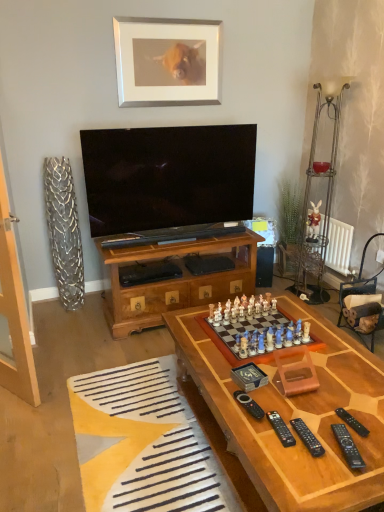
This screenshot has width=384, height=512. What do you see at coordinates (358, 285) in the screenshot? I see `wooden armchair at right` at bounding box center [358, 285].

What is the approximate width of white radiator at right?

It is 6.74 centimeters.

Looking at this image, in order to face yellow fabric rug at lower left, should I rotate leftwards or rightwards?

To align with it, rotate left about 6.375°.

You are a GUI agent. You are given a task and a screenshot of the screen. Output one action in this format:
    pyautogui.click(x=<x>, y=<y>)
    Task: Click on the wooden armchair at right
    Image resolution: width=384 pixels, height=512 pixels.
    Given the screenshot: What is the action you would take?
    pyautogui.click(x=358, y=285)

Does black plastic remote at center, which ranks as the 5th remote in right-to-left order, have a smaller size compared to wooden armchair at right?

Correct, black plastic remote at center, which ranks as the 5th remote in right-to-left order, occupies less space than wooden armchair at right.

Does black plastic remote at center, which appears as the first remote when viewed from the left, have a greater height compared to wooden armchair at right?

No.

Considering the relative positions of black plastic remote at center, which ranks as the 5th remote in right-to-left order, and wooden armchair at right in the image provided, is black plastic remote at center, which ranks as the 5th remote in right-to-left order, in front of wooden armchair at right?

Yes, black plastic remote at center, which ranks as the 5th remote in right-to-left order, is closer to the camera.

How different are the orientations of black plastic remote at center, which appears as the first remote when viewed from the left, and wooden armchair at right in degrees?

black plastic remote at center, which appears as the first remote when viewed from the left, and wooden armchair at right are facing 84.3 degrees away from each other.

You are a GUI agent. You are given a task and a screenshot of the screen. Output one action in this format:
    pyautogui.click(x=<x>, y=<y>)
    Task: Click on the table on the right of the black plastic remote at lower right, which is the 2th remote from left to right
    This screenshot has width=384, height=512.
    Given the screenshot: What is the action you would take?
    pyautogui.click(x=294, y=414)

Considering the positions of point (283, 425) and point (358, 364), is point (283, 425) closer or farther from the camera than point (358, 364)?

Clearly, point (283, 425) is closer to the camera than point (358, 364).

Is black plastic remote at lower right, the 4th remote in the right-to-left sequence, closer to the viewer compared to wooden chessboard at center?

No, the depth of black plastic remote at lower right, the 4th remote in the right-to-left sequence, is greater than that of wooden chessboard at center.

Does black plastic remote at lower right, the 4th remote in the right-to-left sequence, contain wooden chessboard at center?

No, black plastic remote at lower right, the 4th remote in the right-to-left sequence, does not contain wooden chessboard at center.

Is black plastic remote at lower right, marked as the 2th remote in a right-to-left arrangement, spatially inside metallic glass shelf at right, or outside of it?

black plastic remote at lower right, marked as the 2th remote in a right-to-left arrangement, is not enclosed by metallic glass shelf at right.

Could you tell me if black plastic remote at lower right, marked as the 2th remote in a right-to-left arrangement, is turned towards metallic glass shelf at right?

Yes.

Looking at their sizes, would you say black plastic remote at lower right, the fourth remote when ordered from left to right, is wider or thinner than metallic glass shelf at right?

Considering their sizes, black plastic remote at lower right, the fourth remote when ordered from left to right, looks slimmer than metallic glass shelf at right.

Is black plastic remote at lower right, the fourth remote when ordered from left to right, at the right side of metallic glass shelf at right?

Incorrect, black plastic remote at lower right, the fourth remote when ordered from left to right, is not on the right side of metallic glass shelf at right.

From the image's perspective, which is above, white radiator at right or white ceramic rabbit at right?

white ceramic rabbit at right.

Which of these two, white radiator at right or white ceramic rabbit at right, is thinner?

white radiator at right.

Which is more to the left, white radiator at right or white ceramic rabbit at right?

white ceramic rabbit at right.

The image size is (384, 512). Find the location of `toy behind the white radiator at right`. toy behind the white radiator at right is located at coordinates (313, 222).

How distant is white ceramic rabbit at right from silver/metallic picture frame at upper center?

They are 1.55 meters apart.

From the image's perspective, is white ceramic rabbit at right beneath silver/metallic picture frame at upper center?

Yes, from the image's perspective, white ceramic rabbit at right is below silver/metallic picture frame at upper center.

I want to click on picture frame above the white ceramic rabbit at right (from the image's perspective), so click(x=167, y=61).

Is white ceramic rabbit at right at the right side of silver/metallic picture frame at upper center?

Yes, white ceramic rabbit at right is to the right of silver/metallic picture frame at upper center.

Considering the sizes of objects silver/metallic picture frame at upper center and black plastic remote at lower right, which is the 2th remote from left to right, in the image provided, who is shorter, silver/metallic picture frame at upper center or black plastic remote at lower right, which is the 2th remote from left to right,?

black plastic remote at lower right, which is the 2th remote from left to right, is shorter.

Consider the image. Are silver/metallic picture frame at upper center and black plastic remote at lower right, the 4th remote in the right-to-left sequence, beside each other?

No, silver/metallic picture frame at upper center is not with black plastic remote at lower right, the 4th remote in the right-to-left sequence.

Does silver/metallic picture frame at upper center have a smaller size compared to black plastic remote at lower right, which is the 2th remote from left to right?

No, silver/metallic picture frame at upper center is not smaller than black plastic remote at lower right, which is the 2th remote from left to right.

The image size is (384, 512). Find the location of `picture frame above the black plastic remote at lower right, the 4th remote in the right-to-left sequence (from a real-world perspective)`. picture frame above the black plastic remote at lower right, the 4th remote in the right-to-left sequence (from a real-world perspective) is located at coordinates (167, 61).

Considering the sizes of objects wooden chess set at center and black plastic remote at lower right, the third remote in the left-to-right sequence, in the image provided, who is shorter, wooden chess set at center or black plastic remote at lower right, the third remote in the left-to-right sequence,?

With less height is wooden chess set at center.

I want to click on remote that is the 4th object located below the wooden chess set at center (from the image's perspective), so click(307, 437).

From the image's perspective, which one is positioned higher, wooden chess set at center or black plastic remote at lower right, which ranks as the 3th remote in right-to-left order?

wooden chess set at center, from the image's perspective.

Is wooden chess set at center to the right of black plastic remote at lower right, the third remote in the left-to-right sequence, from the viewer's perspective?

In fact, wooden chess set at center is to the left of black plastic remote at lower right, the third remote in the left-to-right sequence.

This screenshot has width=384, height=512. Find the location of `remote that is the 1st object located in front of the wooden armchair at right`. remote that is the 1st object located in front of the wooden armchair at right is located at coordinates (249, 405).

The height and width of the screenshot is (512, 384). In order to click on the 2nd remote counting from the left side of the wooden chessboard at center in this screenshot , I will do `click(281, 429)`.

Looking at the image, which one is located closer to black plastic remote at center, which appears as the first remote when viewed from the left, yellow fabric rug at lower left or wooden chess set at center?

wooden chess set at center.

Looking at the image, which one is located further to metallic glass shelf at right, white radiator at right or black plastic remote at lower right, which appears as the 5th remote when viewed from the left?

The object further to metallic glass shelf at right is black plastic remote at lower right, which appears as the 5th remote when viewed from the left.

Based on their spatial positions, is white radiator at right or wooden chess set at center further from black plastic remote at center, which appears as the first remote when viewed from the left?

white radiator at right is positioned further to the anchor black plastic remote at center, which appears as the first remote when viewed from the left.

When comparing their distances from wooden armchair at right, does black plastic remote at lower right, marked as the 2th remote in a right-to-left arrangement, or wooden chessboard at center seem further?

black plastic remote at lower right, marked as the 2th remote in a right-to-left arrangement, is further to wooden armchair at right.

When comparing their distances from silver/metallic picture frame at upper center, does black plastic remote at lower right, which appears as the 5th remote when viewed from the left, or white radiator at right seem closer?

white radiator at right.

Which object lies further to the anchor point yellow fabric rug at lower left, silver/metallic picture frame at upper center or black plastic remote at lower right, which appears as the 5th remote when viewed from the left?

Among the two, silver/metallic picture frame at upper center is located further to yellow fabric rug at lower left.

Looking at the image, which one is located further to yellow fabric rug at lower left, black plastic remote at lower right, the third remote in the left-to-right sequence, or white ceramic rabbit at right?

white ceramic rabbit at right is further to yellow fabric rug at lower left.

Looking at this image, when comparing their distances from black plastic remote at lower right, which appears as the 5th remote when viewed from the left, does yellow fabric rug at lower left or black plastic remote at lower right, the fourth remote when ordered from left to right, seem further?

Based on the image, yellow fabric rug at lower left appears to be further to black plastic remote at lower right, which appears as the 5th remote when viewed from the left.

The height and width of the screenshot is (512, 384). Find the location of `board game between black plastic remote at lower right, which ranks as the 3th remote in right-to-left order, and metallic glass shelf at right in the front-back direction`. board game between black plastic remote at lower right, which ranks as the 3th remote in right-to-left order, and metallic glass shelf at right in the front-back direction is located at coordinates (242, 332).

Image resolution: width=384 pixels, height=512 pixels. In order to click on board game between yellow fabric rug at lower left and black plastic remote at lower right, which appears as the 5th remote when viewed from the left in this screenshot , I will do `click(242, 332)`.

The width and height of the screenshot is (384, 512). I want to click on board game located between wooden chessboard at center and wooden armchair at right in the depth direction, so click(x=242, y=332).

I want to click on foosball between wooden chessboard at center and white ceramic rabbit at right along the z-axis, so click(x=144, y=443).